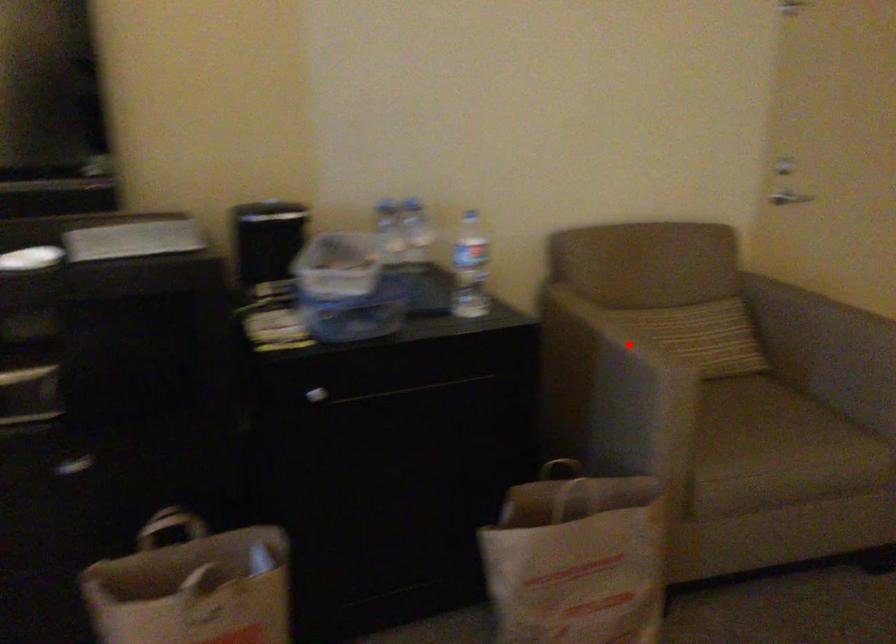
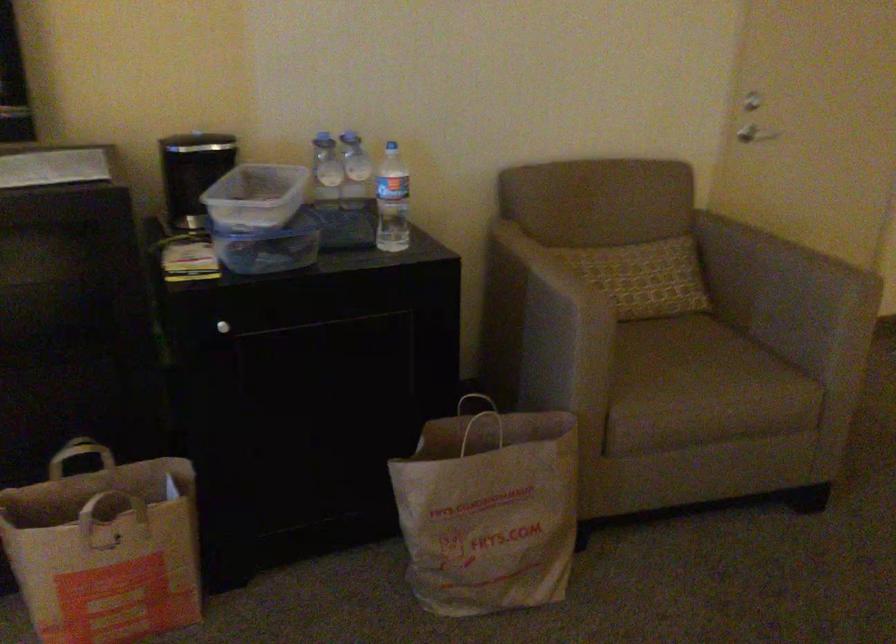
Question: I am providing you with two images of the same scene from different viewpoints. A red point is marked on the first image. Can you still see the location of the red point in image 2?

Choices:
 (A) Yes
 (B) No

Answer: (A)